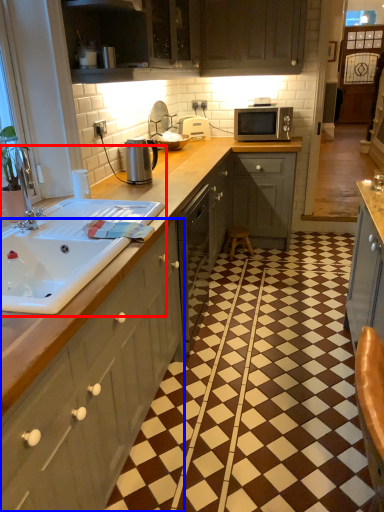
Question: Among these objects, which one is farthest to the camera, sink (highlighted by a red box) or cabinetry (highlighted by a blue box)?

Choices:
 (A) sink
 (B) cabinetry

Answer: (A)